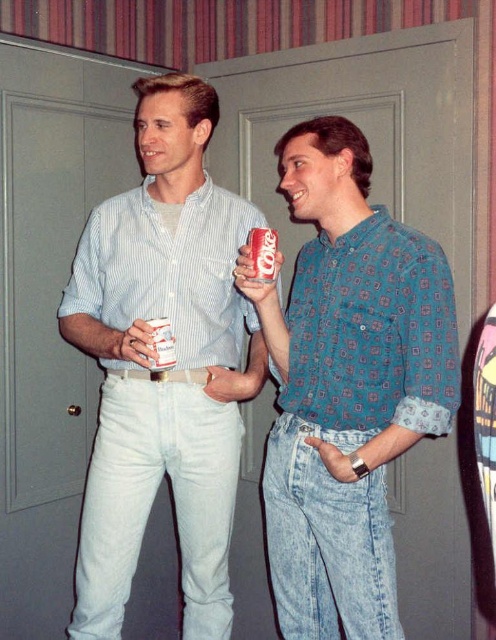
Question: Which point is farther to the camera?

Choices:
 (A) matte plastic can at center
 (B) light blue striped shirt at center
 (C) white paper cup at center
 (D) blue printed shirt at center

Answer: (A)

Question: Among these objects, which one is farthest from the camera?

Choices:
 (A) blue printed shirt at center
 (B) white paper cup at center
 (C) matte plastic can at center
 (D) light blue striped shirt at center

Answer: (C)

Question: Can you confirm if matte plastic can at center is positioned to the left of white paper cup at center?

Choices:
 (A) no
 (B) yes

Answer: (A)

Question: Estimate the real-world distances between objects in this image. Which object is farther from the light blue striped shirt at center?

Choices:
 (A) matte plastic can at center
 (B) blue printed shirt at center
 (C) white paper cup at center

Answer: (A)

Question: Where is light blue striped shirt at center located in relation to white paper cup at center in the image?

Choices:
 (A) below
 (B) above

Answer: (A)

Question: Can you confirm if light blue striped shirt at center is smaller than white paper cup at center?

Choices:
 (A) yes
 (B) no

Answer: (B)